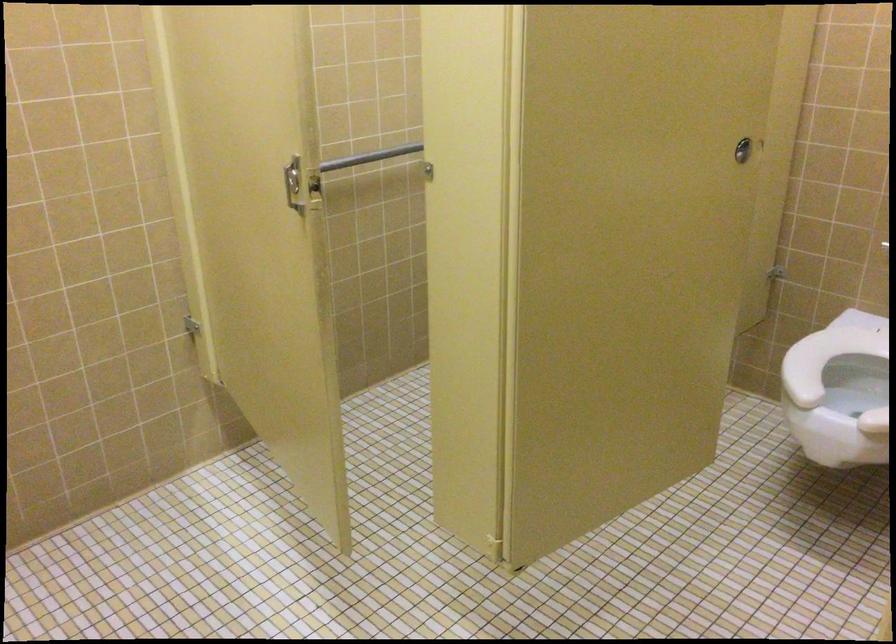
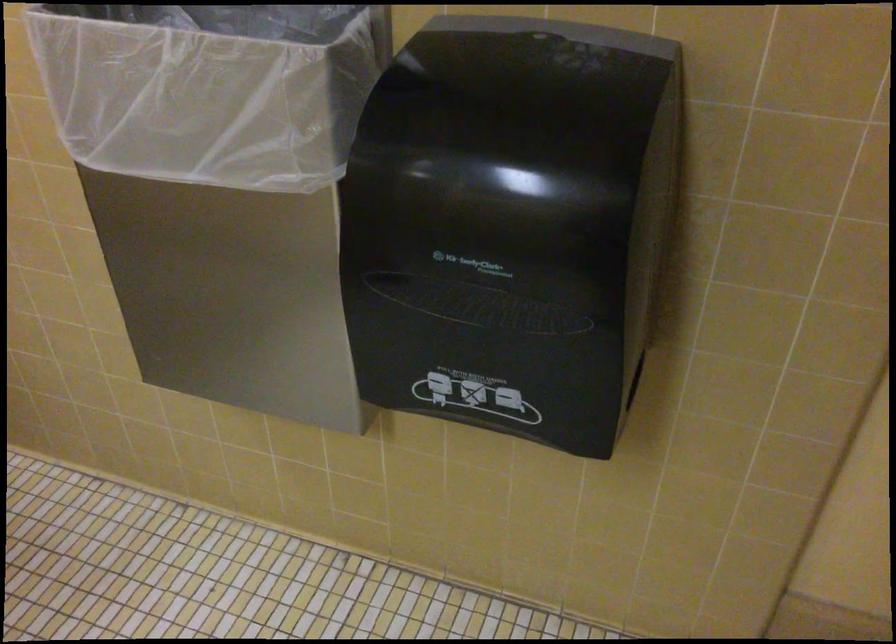
How did the camera likely rotate?

The camera rotated toward right-down.